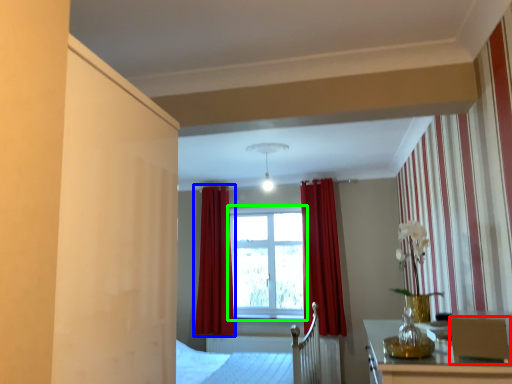
Question: Which is nearer to the armchair (highlighted by a red box)? curtain (highlighted by a blue box) or window (highlighted by a green box).

Choices:
 (A) curtain
 (B) window

Answer: (B)